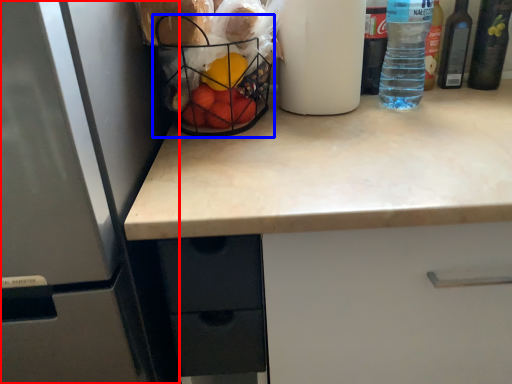
Question: Which object appears farthest to the camera in this image, refrigerator (highlighted by a red box) or basket (highlighted by a blue box)?

Choices:
 (A) refrigerator
 (B) basket

Answer: (B)